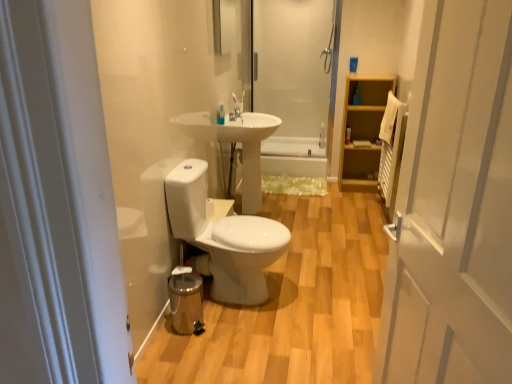
Locate an element on the screen. The image size is (512, 384). vacant region to the right of white glossy toilet at center is located at coordinates (324, 288).